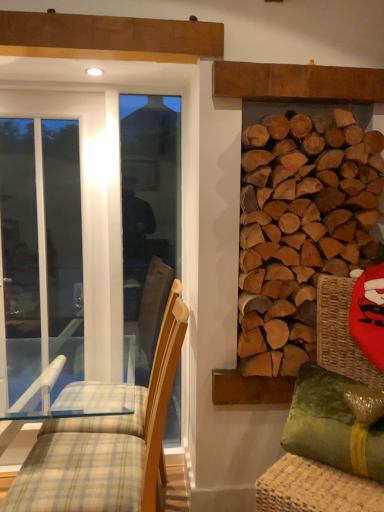
Question: Should I look upward or downward to see green fabric swivel chair at right?

Choices:
 (A) up
 (B) down

Answer: (B)

Question: Does white glass screen door at left lie in front of natural wood logs at right?

Choices:
 (A) yes
 (B) no

Answer: (B)

Question: Is white glass screen door at left far from natural wood logs at right?

Choices:
 (A) yes
 (B) no

Answer: (A)

Question: Considering the relative sizes of white glass screen door at left and natural wood logs at right in the image provided, is white glass screen door at left bigger than natural wood logs at right?

Choices:
 (A) no
 (B) yes

Answer: (A)

Question: Is white glass screen door at left oriented towards natural wood logs at right?

Choices:
 (A) yes
 (B) no

Answer: (B)

Question: Does white glass screen door at left have a lesser width compared to natural wood logs at right?

Choices:
 (A) no
 (B) yes

Answer: (B)

Question: From a real-world perspective, is white glass screen door at left located higher than natural wood logs at right?

Choices:
 (A) yes
 (B) no

Answer: (B)

Question: Is light brown wood chair at left oriented away from green fabric swivel chair at right?

Choices:
 (A) yes
 (B) no

Answer: (A)

Question: Is light brown wood chair at left behind green fabric swivel chair at right?

Choices:
 (A) yes
 (B) no

Answer: (A)

Question: Is light brown wood chair at left smaller than green fabric swivel chair at right?

Choices:
 (A) no
 (B) yes

Answer: (B)

Question: Is there a large distance between light brown wood chair at left and green fabric swivel chair at right?

Choices:
 (A) no
 (B) yes

Answer: (A)

Question: From a real-world perspective, does light brown wood chair at left sit lower than green fabric swivel chair at right?

Choices:
 (A) no
 (B) yes

Answer: (A)

Question: Does light brown wood chair at left appear on the left side of green fabric swivel chair at right?

Choices:
 (A) yes
 (B) no

Answer: (A)

Question: Can you confirm if natural wood logs at right is positioned to the right of white glass screen door at left?

Choices:
 (A) yes
 (B) no

Answer: (A)